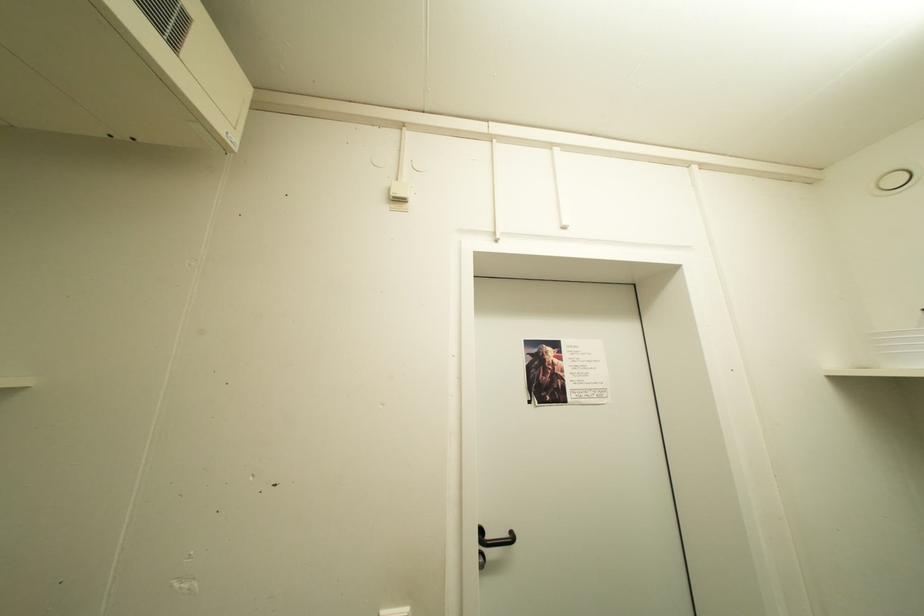
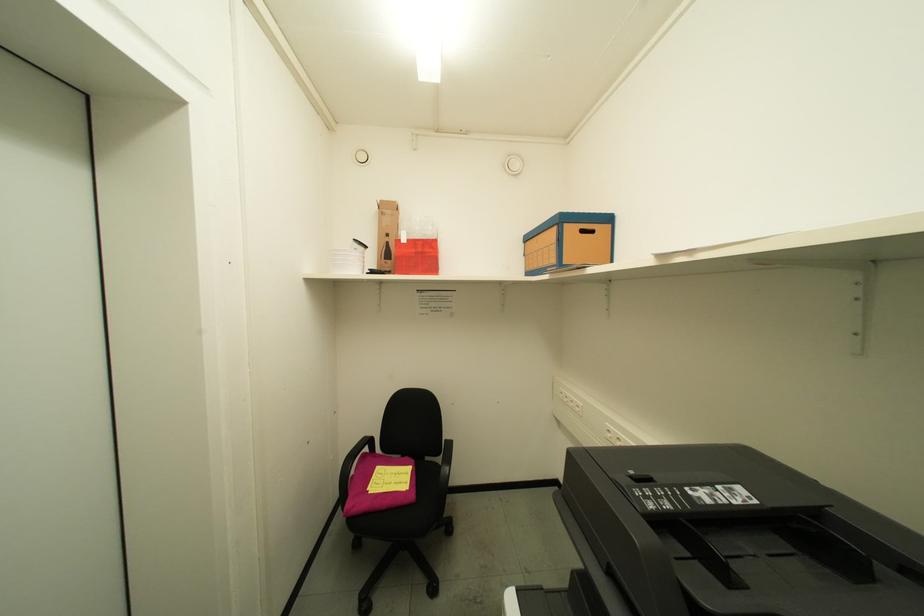
Question: The first image is from the beginning of the video and the second image is from the end. How did the camera likely rotate when shooting the video?

Choices:
 (A) Left
 (B) Right
 (C) Up
 (D) Down

Answer: (B)